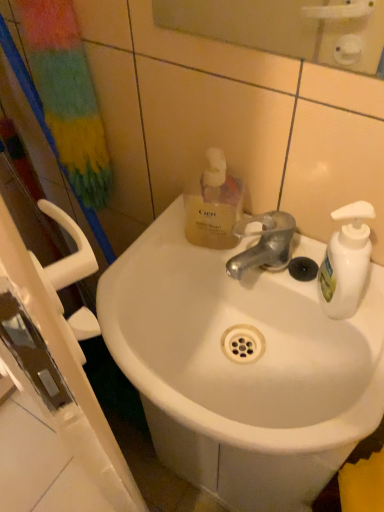
Question: Is white ceramic sink at center bigger or smaller than glossy plastic mirror at upper center?

Choices:
 (A) small
 (B) big

Answer: (B)

Question: From the image's perspective, is white ceramic sink at center located above or below glossy plastic mirror at upper center?

Choices:
 (A) above
 (B) below

Answer: (B)

Question: Estimate the real-world distances between objects in this image. Which object is farther from the white ceramic sink at center?

Choices:
 (A) translucent yellow liquid at upper center
 (B) glossy plastic mirror at upper center

Answer: (B)

Question: Based on their relative distances, which object is nearer to the translucent yellow liquid at upper center?

Choices:
 (A) glossy plastic mirror at upper center
 (B) white ceramic sink at center

Answer: (B)